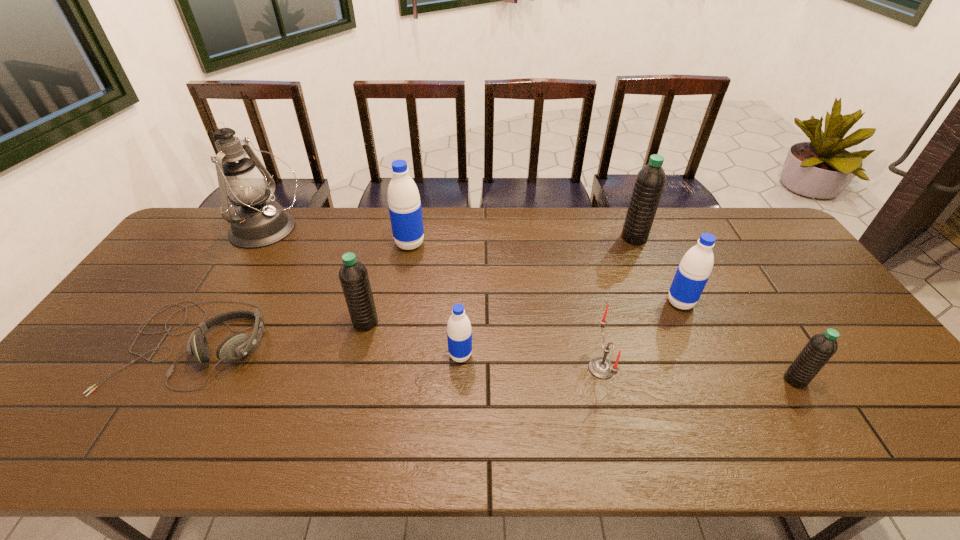
At what (x,y) coordinates should I click in order to perform the action: click on free space located on the front of the second smallest blue water bottle. Please return your answer as a coordinate pair (x, y). Looking at the image, I should click on (737, 428).

Identify the location of free point located on the back of the nearest water bottle. The width and height of the screenshot is (960, 540). (758, 320).

Image resolution: width=960 pixels, height=540 pixels. I want to click on vacant space located 0.170m on the right of the fifth farthest water bottle, so click(x=538, y=355).

In order to click on vacant space located 0.330m on the front-facing side of the candle in this screenshot , I will do `click(458, 368)`.

At what (x,y) coordinates should I click in order to perform the action: click on vacant space located 0.150m on the front-facing side of the candle. Please return your answer as a coordinate pair (x, y). Looking at the image, I should click on (529, 368).

The width and height of the screenshot is (960, 540). What are the coordinates of `free region located 0.190m on the front-facing side of the candle` in the screenshot? It's located at (514, 368).

Locate an element on the screen. Image resolution: width=960 pixels, height=540 pixels. vacant region located on the outer surface of the shortest object is located at coordinates (144, 428).

At what (x,y) coordinates should I click in order to perform the action: click on oil lamp positioned at the far edge. Please return your answer as a coordinate pair (x, y). Looking at the image, I should click on (258, 222).

Find the location of a particular element. This screenshot has height=540, width=960. oil lamp at the left edge is located at coordinates (258, 222).

I want to click on headset that is positioned at the left edge, so click(x=234, y=347).